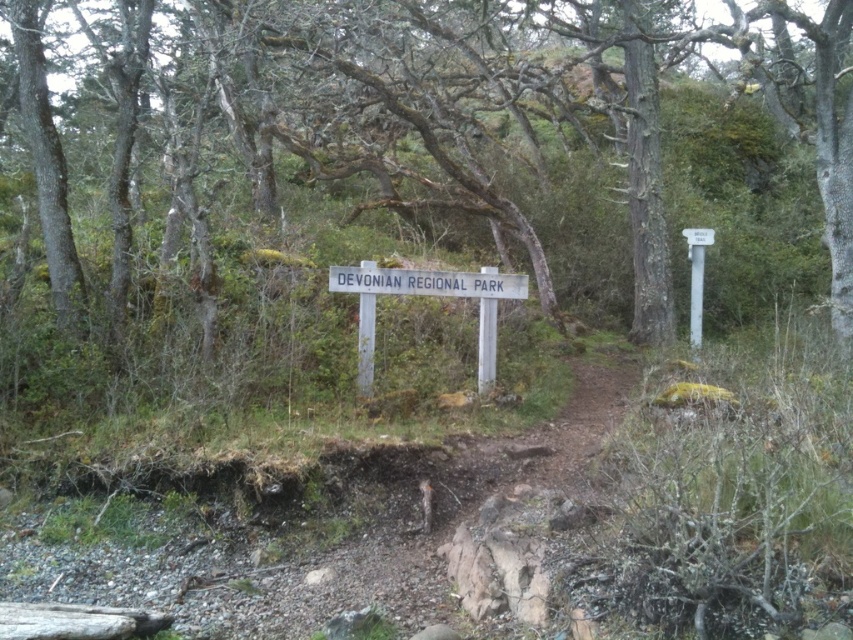
In the scene shown: Which is above, green mossy tree at center or white plastic signpost at upper right?

green mossy tree at center

Does green mossy tree at center have a greater height compared to white plastic signpost at upper right?

No.

Who is more forward, (35, 93) or (695, 253)?

Point (35, 93) is more forward.

The width and height of the screenshot is (853, 640). Identify the location of green mossy tree at center. (428, 131).

Which is in front, point (265, 76) or point (490, 320)?

Point (490, 320) is more forward.

Is green mossy tree at center above white wooden sign at center?

Yes.

Between point (322, 36) and point (431, 292), which one is positioned in front?

Point (431, 292)

Find the location of `green mossy tree at center`. green mossy tree at center is located at coordinates (428, 131).

Is point (421, 288) less distant than point (694, 275)?

Yes, point (421, 288) is in front of point (694, 275).

Which is in front, point (503, 273) or point (708, 230)?

Point (503, 273)

Identify the location of white wooden sign at center. The height and width of the screenshot is (640, 853). (427, 294).